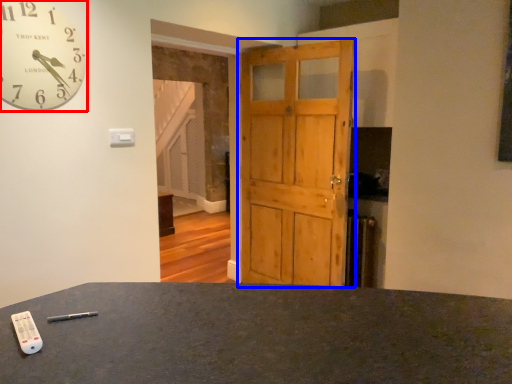
Question: Which object appears closest to the camera in this image, wall clock (highlighted by a red box) or barn door (highlighted by a blue box)?

Choices:
 (A) wall clock
 (B) barn door

Answer: (A)